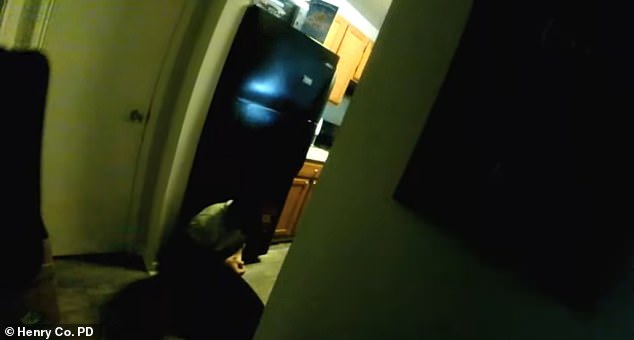
Where is `kitchen floor`? The width and height of the screenshot is (634, 340). kitchen floor is located at coordinates (255, 270), (283, 250).